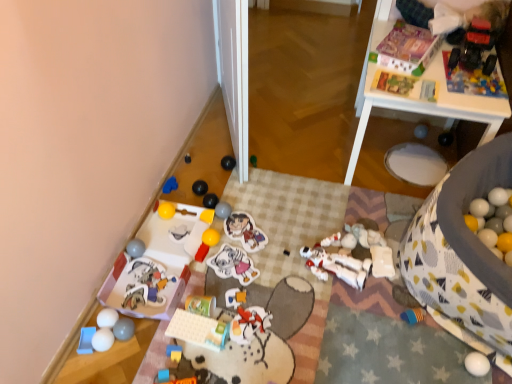
Where is `vacant space positioned to the left of white matte balls at lower left, which appears as the 2th toy when viewed from the left`? The image size is (512, 384). vacant space positioned to the left of white matte balls at lower left, which appears as the 2th toy when viewed from the left is located at coordinates (75, 348).